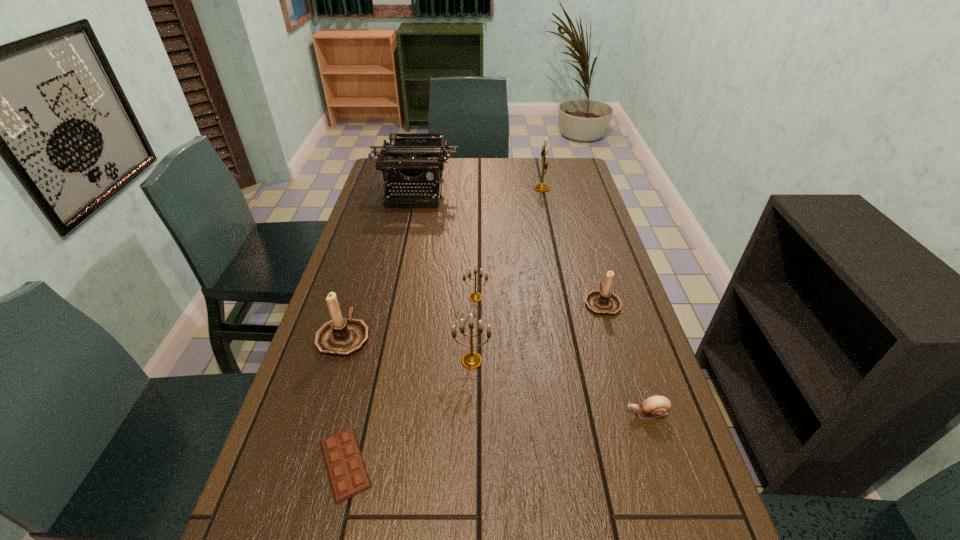
What are the coordinates of `the tallest candelabrum` in the screenshot? It's located at (540, 187).

Locate an element on the screen. This screenshot has height=540, width=960. the fourth candelabrum from left to right is located at coordinates (540, 187).

The image size is (960, 540). I want to click on typewriter, so click(x=409, y=159).

Identify the location of the second smallest gold candelabrum. The image size is (960, 540). (471, 360).

Locate an element on the screen. the left brown candle holder is located at coordinates pos(343,337).

The image size is (960, 540). What are the coordinates of `the leftmost candelabrum` in the screenshot? It's located at (343, 337).

Locate an element on the screen. the smaller brown candle holder is located at coordinates (604, 302).

Locate an element on the screen. The height and width of the screenshot is (540, 960). the rightmost candelabrum is located at coordinates (604, 302).

Locate an element on the screen. the second nearest gold candelabrum is located at coordinates (475, 296).

The image size is (960, 540). Identify the location of escargot. (656, 406).